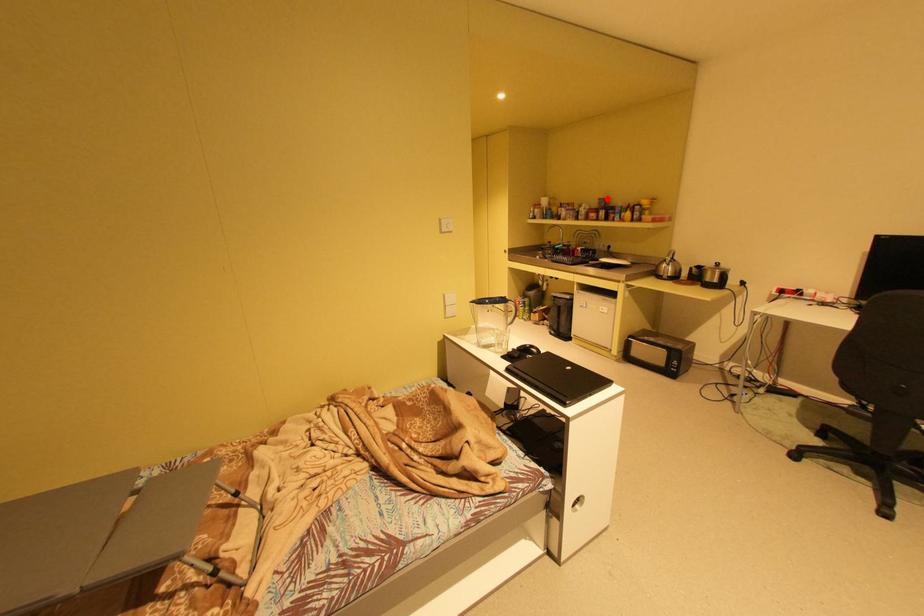
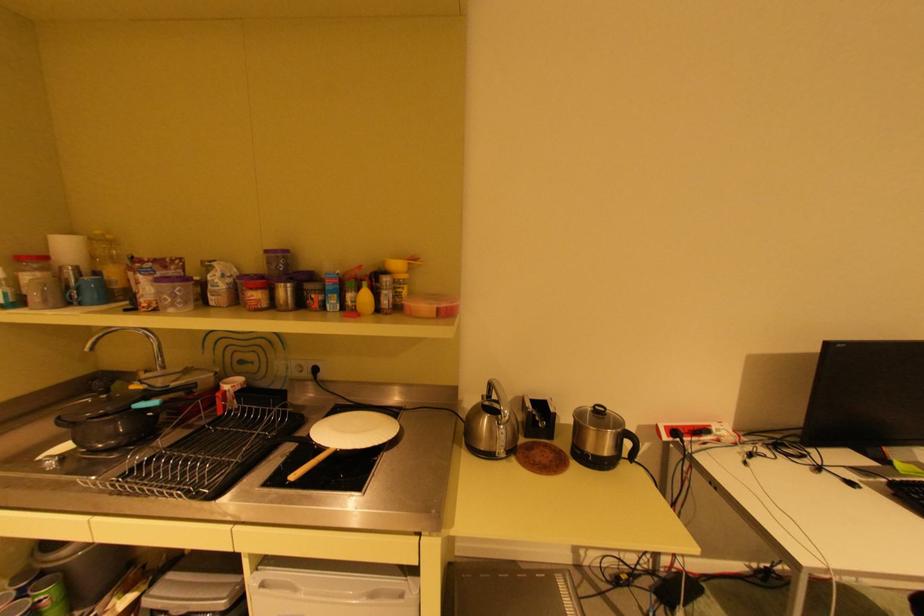
The point at the highlighted location is marked in the first image. Where is the corresponding point in the second image?

(274, 251)